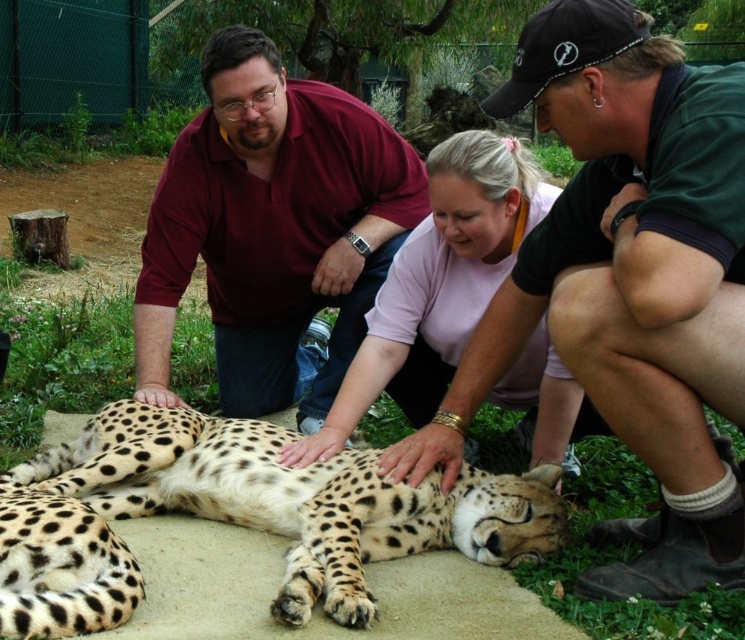
Question: Can you confirm if green fabric cap at upper right is positioned above spotted fur cheetah at center?

Choices:
 (A) no
 (B) yes

Answer: (B)

Question: Considering the real-world distances, which object is farthest from the green fabric cap at upper right?

Choices:
 (A) pink matte shirt at center
 (B) maroon shirt at upper left

Answer: (B)

Question: Which object appears farthest from the camera in this image?

Choices:
 (A) pink matte shirt at center
 (B) maroon shirt at upper left
 (C) spotted fur cheetah at center

Answer: (B)

Question: Is maroon shirt at upper left in front of spotted fur cheetah at center?

Choices:
 (A) yes
 (B) no

Answer: (B)

Question: Does maroon shirt at upper left appear on the right side of spotted fur cheetah at center?

Choices:
 (A) yes
 (B) no

Answer: (B)

Question: Considering the real-world distances, which object is closest to the spotted fur cheetah at center?

Choices:
 (A) green fabric cap at upper right
 (B) pink matte shirt at center
 (C) maroon shirt at upper left

Answer: (B)